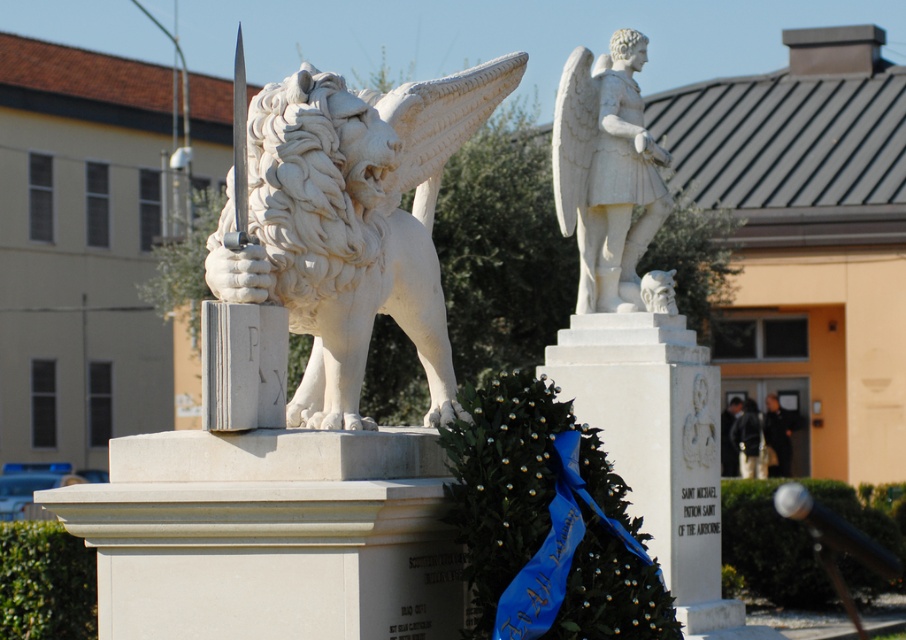
Does white marble pillar at center appear on the left side of white marble angel at upper right?

Incorrect, white marble pillar at center is not on the left side of white marble angel at upper right.

Is white marble pillar at center closer to the viewer compared to white marble angel at upper right?

Yes, white marble pillar at center is closer to the viewer.

Which is behind, point (699, 346) or point (562, 74)?

The point (562, 74) is more distant.

Identify the location of white marble pillar at center. (657, 445).

Is white marble lion at center to the left of white marble angel at upper right from the viewer's perspective?

Yes, white marble lion at center is to the left of white marble angel at upper right.

Who is taller, white marble lion at center or white marble angel at upper right?

Standing taller between the two is white marble angel at upper right.

You are a GUI agent. You are given a task and a screenshot of the screen. Output one action in this format:
    pyautogui.click(x=<x>, y=<y>)
    Task: Click on the white marble lion at center
    
    Given the screenshot: What is the action you would take?
    pyautogui.click(x=352, y=224)

Between point (344, 288) and point (686, 436), which one is positioned behind?

Positioned behind is point (686, 436).

Does white marble lion at center have a lesser width compared to white marble pillar at center?

Incorrect, white marble lion at center's width is not less than white marble pillar at center's.

You are a GUI agent. You are given a task and a screenshot of the screen. Output one action in this format:
    pyautogui.click(x=<x>, y=<y>)
    Task: Click on the white marble lion at center
    The height and width of the screenshot is (640, 906).
    Given the screenshot: What is the action you would take?
    pyautogui.click(x=352, y=224)